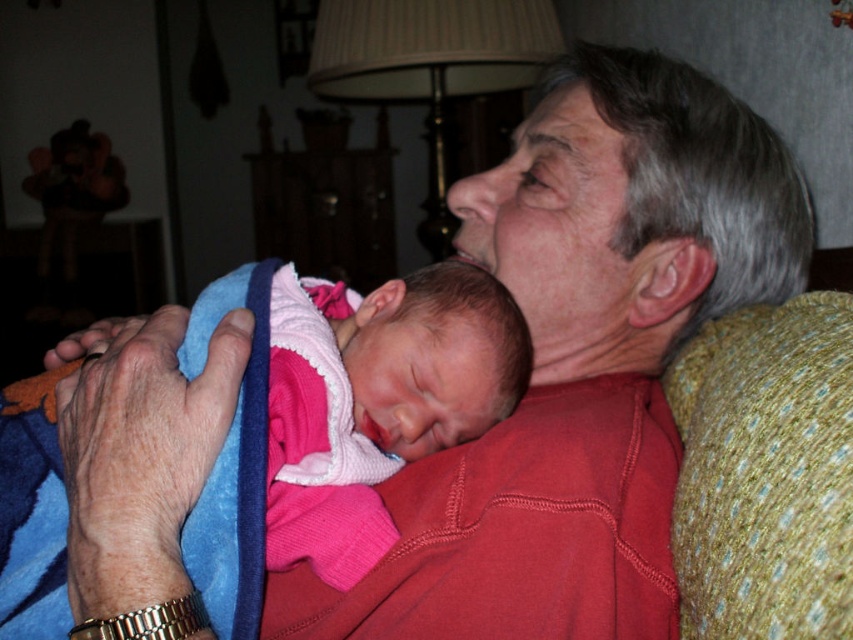
From the picture: Who is higher up, gray hair at upper right or pink fleece blanket at center?

Positioned higher is gray hair at upper right.

Is point (724, 310) farther from camera compared to point (328, 564)?

That is True.

Identify the location of gray hair at upper right. (634, 212).